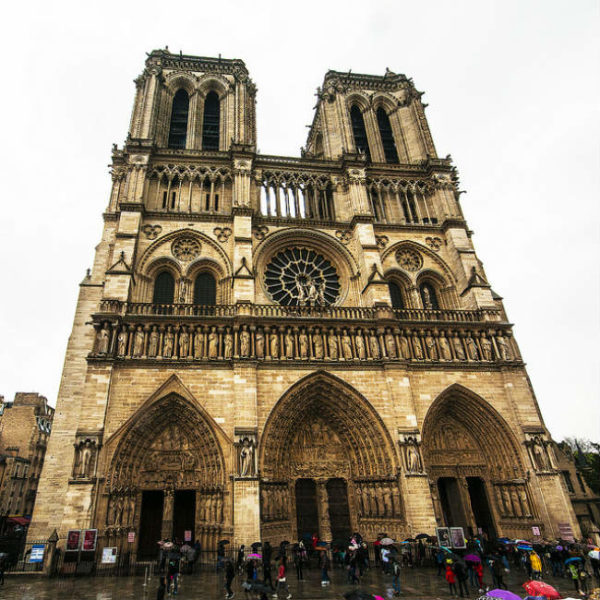
Where is `dark brown arch`? dark brown arch is located at coordinates (318, 393), (171, 411), (453, 403).